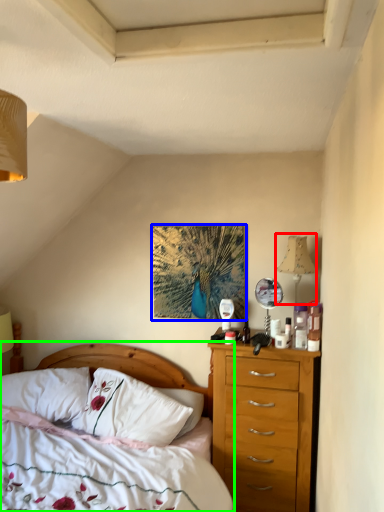
Question: Which object is positioned closest to lamp (highlighted by a red box)? Select from picture frame (highlighted by a blue box) and bed (highlighted by a green box).

Choices:
 (A) picture frame
 (B) bed

Answer: (A)